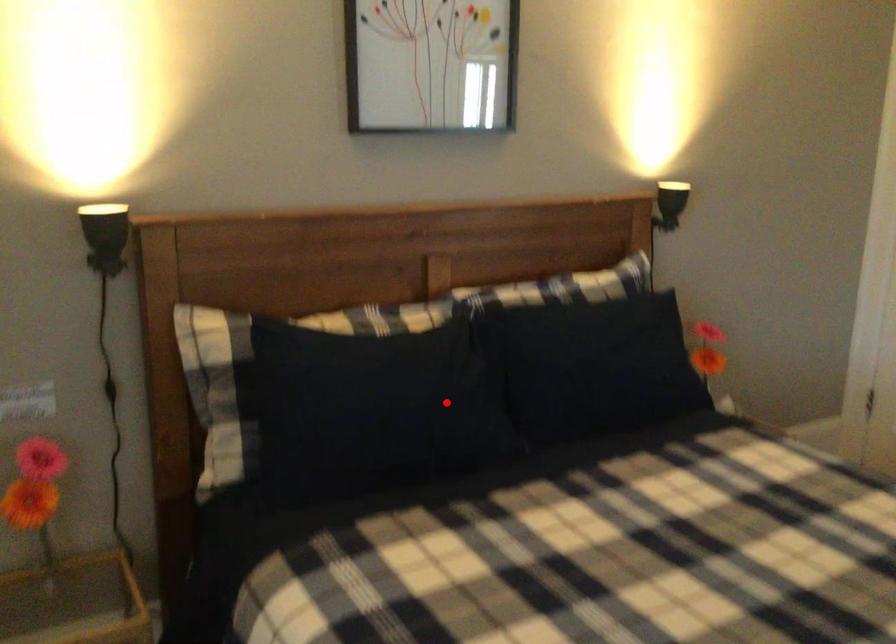
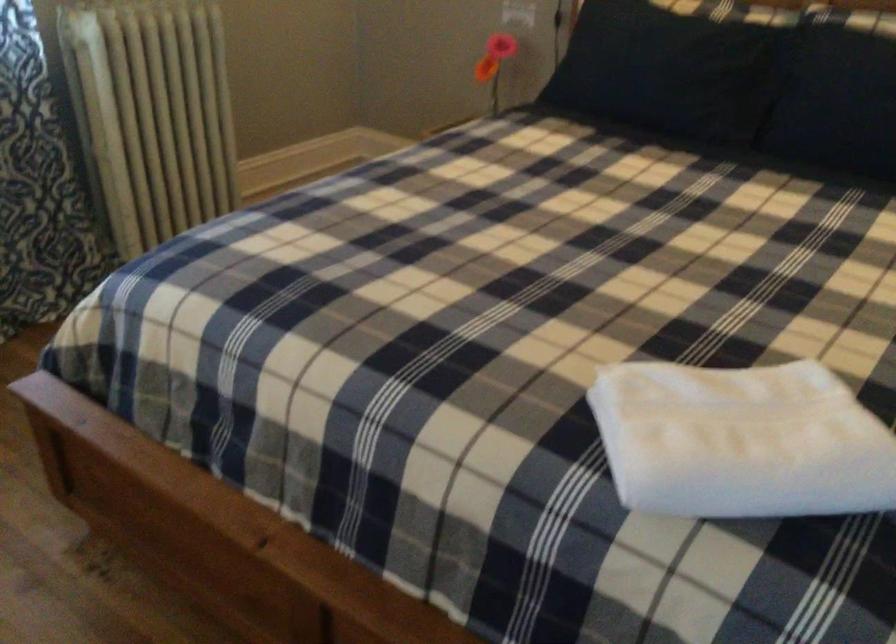
The point at the highlighted location is marked in the first image. Where is the corresponding point in the second image?

(664, 71)